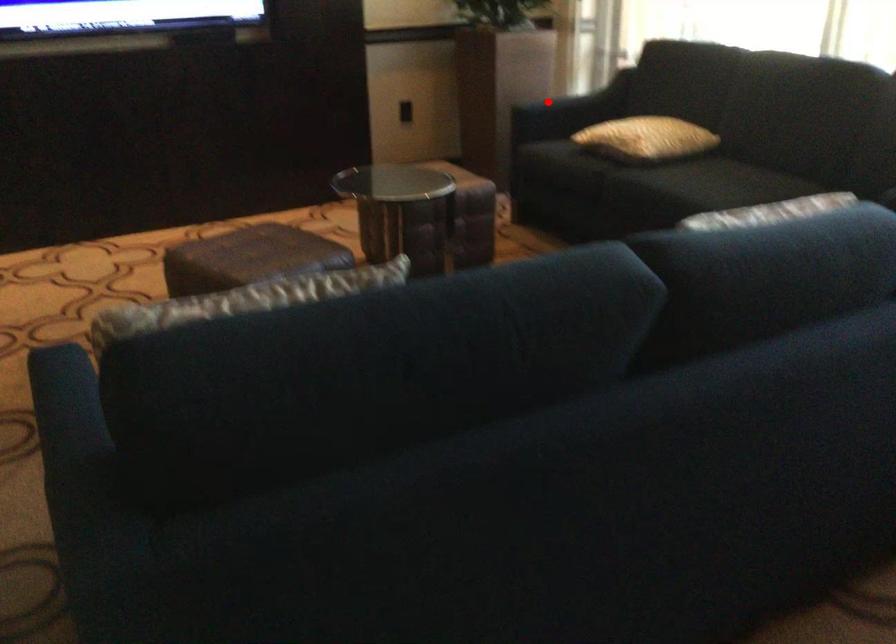
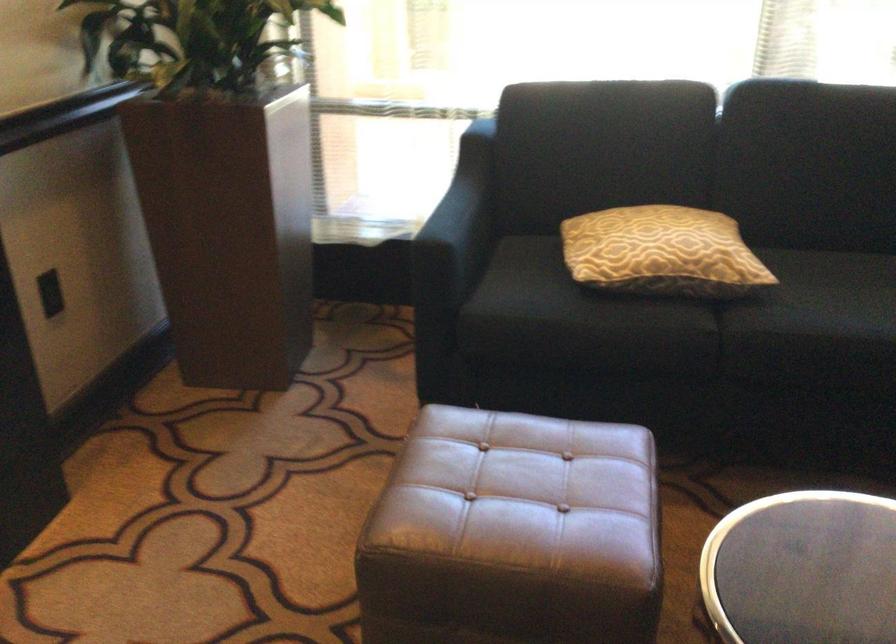
Question: I am providing you with two images of the same scene from different viewpoints. In image1, a red point is highlighted. Considering the same 3D point in image2, which of the following is correct?

Choices:
 (A) It is closer
 (B) It is farther

Answer: (A)